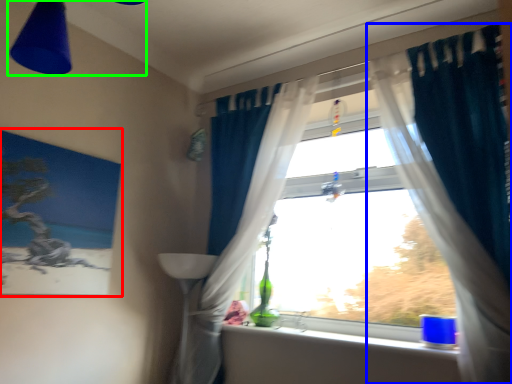
Question: Which is farther away from picture frame (highlighted by a red box)? curtain (highlighted by a blue box) or light fixture (highlighted by a green box)?

Choices:
 (A) curtain
 (B) light fixture

Answer: (A)